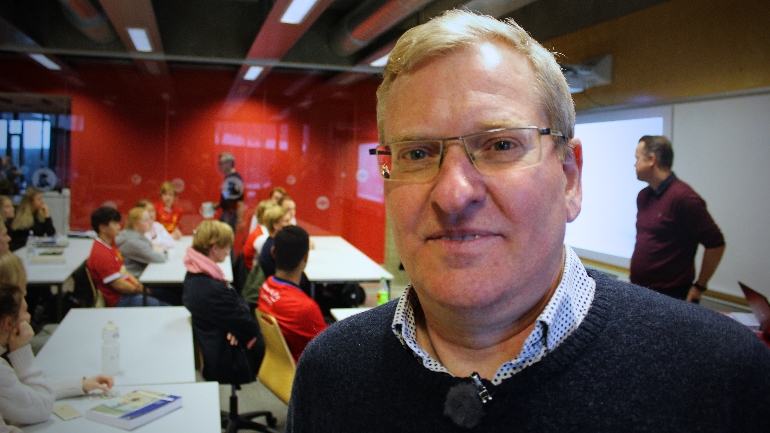
The height and width of the screenshot is (433, 770). Find the location of `wheels of a swivel chair`. wheels of a swivel chair is located at coordinates (272, 419), (266, 427).